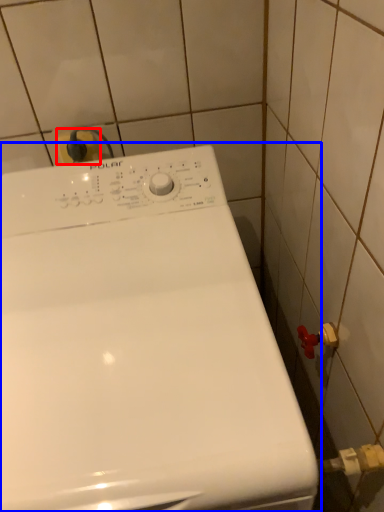
Question: Which object appears farthest to the camera in this image, electric outlet (highlighted by a red box) or washing machine (highlighted by a blue box)?

Choices:
 (A) electric outlet
 (B) washing machine

Answer: (A)